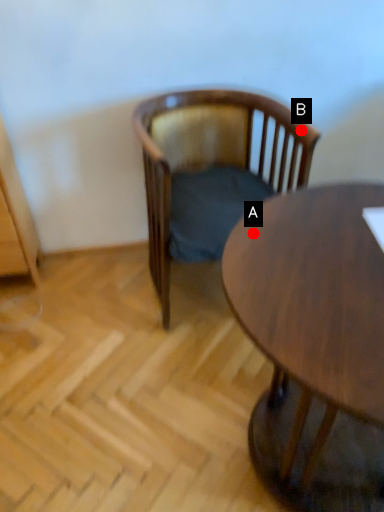
Question: Two points are circled on the image, labeled by A and B beside each circle. Which point appears farthest from the camera in this image?

Choices:
 (A) A is further
 (B) B is further

Answer: (B)